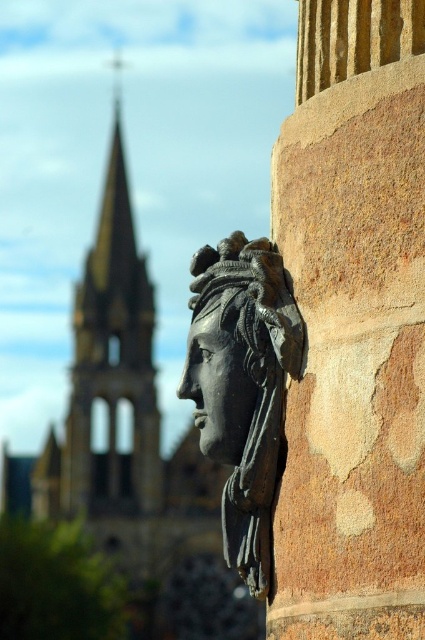
Question: Which point appears closest to the camera in this image?

Choices:
 (A) (215, 355)
 (B) (235, 374)
 (C) (414, 189)
 (D) (133, 284)

Answer: (C)

Question: Does brown rough stone column at right appear on the right side of black polished stone face at center?

Choices:
 (A) yes
 (B) no

Answer: (A)

Question: Can you confirm if brown rough stone column at right is bigger than black stone head at center?

Choices:
 (A) no
 (B) yes

Answer: (B)

Question: Is brown rough stone column at right bigger than black polished stone face at center?

Choices:
 (A) no
 (B) yes

Answer: (B)

Question: Which of the following is the farthest from the observer?

Choices:
 (A) (218, 410)
 (B) (121, 500)
 (C) (237, 518)
 (D) (350, 348)

Answer: (B)

Question: Which of the following is the closest to the observer?

Choices:
 (A) (394, 508)
 (B) (271, 564)
 (C) (112, 419)
 (D) (234, 388)

Answer: (A)